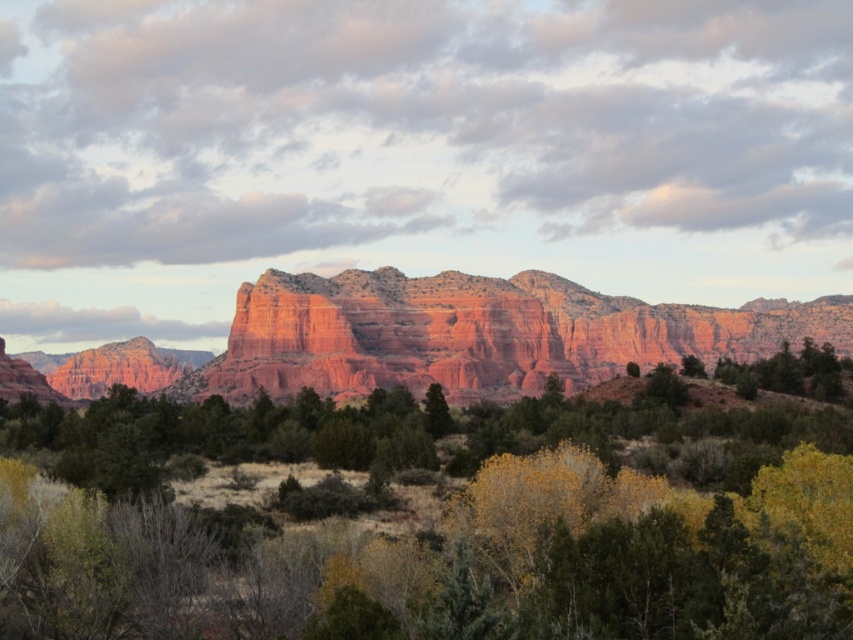
Question: Which point is closer to the camera?

Choices:
 (A) rustic sandstone mountain at center
 (B) green leafy tree at center

Answer: (B)

Question: Does green leafy tree at center appear under rustic sandstone mountain at center?

Choices:
 (A) no
 (B) yes

Answer: (B)

Question: Does green leafy tree at center come behind rustic sandstone mountain at center?

Choices:
 (A) no
 (B) yes

Answer: (A)

Question: Where is green leafy tree at center located in relation to rustic sandstone mountain at center in the image?

Choices:
 (A) above
 (B) below

Answer: (B)